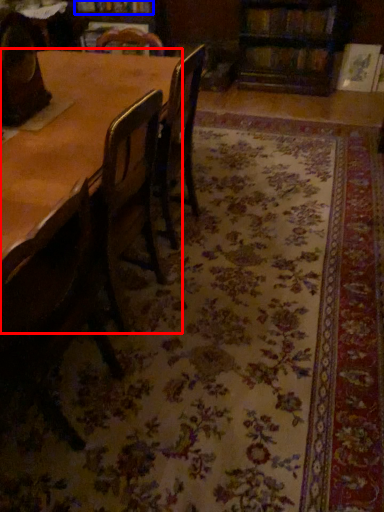
Question: Which object is closer to the camera taking this photo, table (highlighted by a red box) or book (highlighted by a blue box)?

Choices:
 (A) table
 (B) book

Answer: (A)